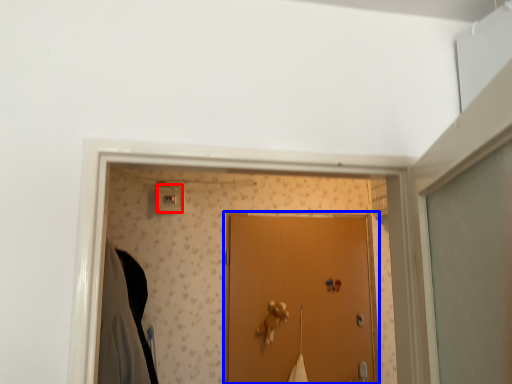
Question: Among these objects, which one is nearest to the camera, light switch (highlighted by a red box) or door (highlighted by a blue box)?

Choices:
 (A) light switch
 (B) door

Answer: (B)